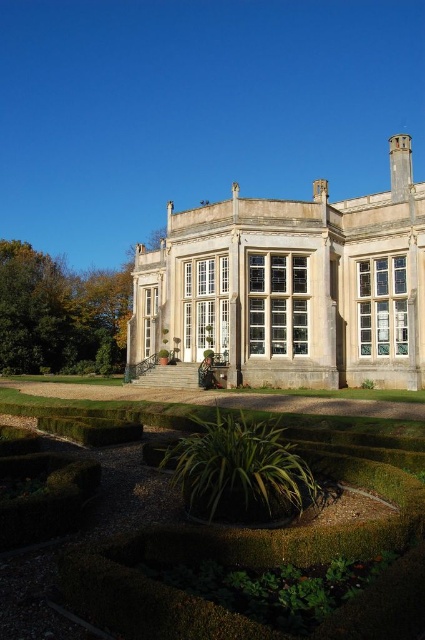
Which is above, green mossy hedge at lower center or green leafy hedge at lower left?

Positioned higher is green leafy hedge at lower left.

Consider the image. Does green mossy hedge at lower center appear on the left side of green leafy hedge at lower left?

In fact, green mossy hedge at lower center is to the right of green leafy hedge at lower left.

Does point (104, 522) lie behind point (53, 304)?

No.

Where is `green mossy hedge at lower center`? This screenshot has height=640, width=425. green mossy hedge at lower center is located at coordinates (209, 541).

Consider the image. Is green leafy hedge at lower left taller than green leafy hedge at lower center?

Indeed, green leafy hedge at lower left has a greater height compared to green leafy hedge at lower center.

How much distance is there between green leafy hedge at lower left and green leafy hedge at lower center?

green leafy hedge at lower left is 75.68 meters from green leafy hedge at lower center.

Between point (107, 284) and point (260, 499), which one is positioned behind?

Point (107, 284)

You are a GUI agent. You are given a task and a screenshot of the screen. Output one action in this format:
    pyautogui.click(x=<x>, y=<y>)
    Task: Click on the green leafy hedge at lower left
    The image size is (425, 640).
    Given the screenshot: What is the action you would take?
    pyautogui.click(x=59, y=314)

Is green mossy hedge at lower center further to the viewer compared to green leafy hedge at lower center?

No.

Does green mossy hedge at lower center have a larger size compared to green leafy hedge at lower center?

Yes.

In order to click on green mossy hedge at lower center in this screenshot , I will do `click(209, 541)`.